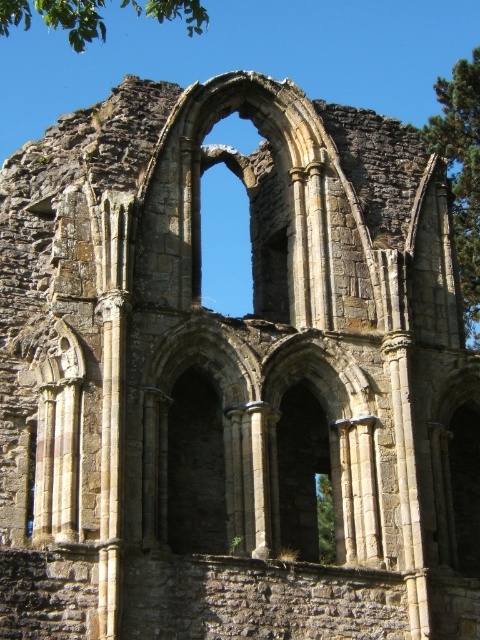
Measure the distance between green leafy tree at upper right and camera.

The distance of green leafy tree at upper right from camera is 57.58 meters.

Is green leafy tree at upper right further to camera compared to green leafy tree at upper left?

Yes.

Where is `green leafy tree at upper right`? The image size is (480, 640). green leafy tree at upper right is located at coordinates (462, 173).